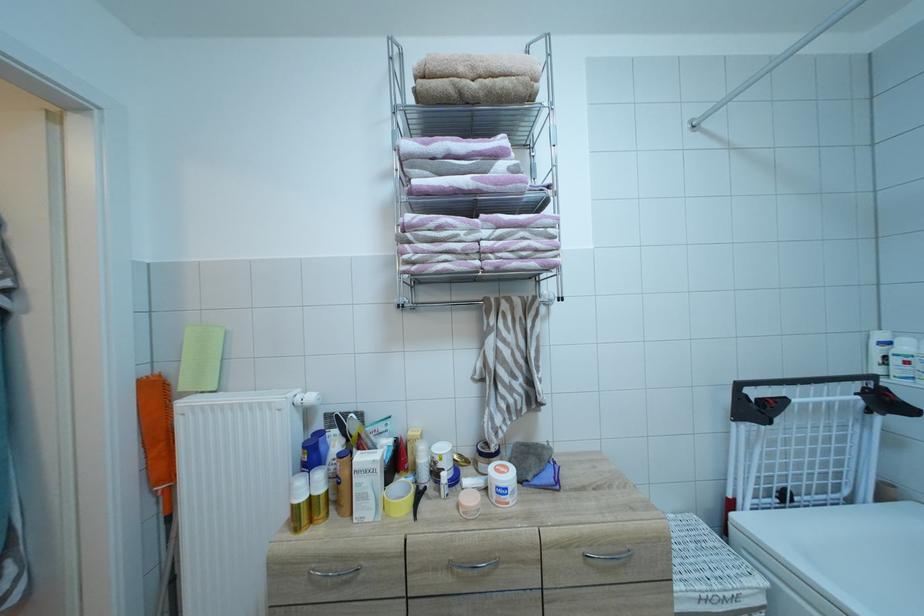
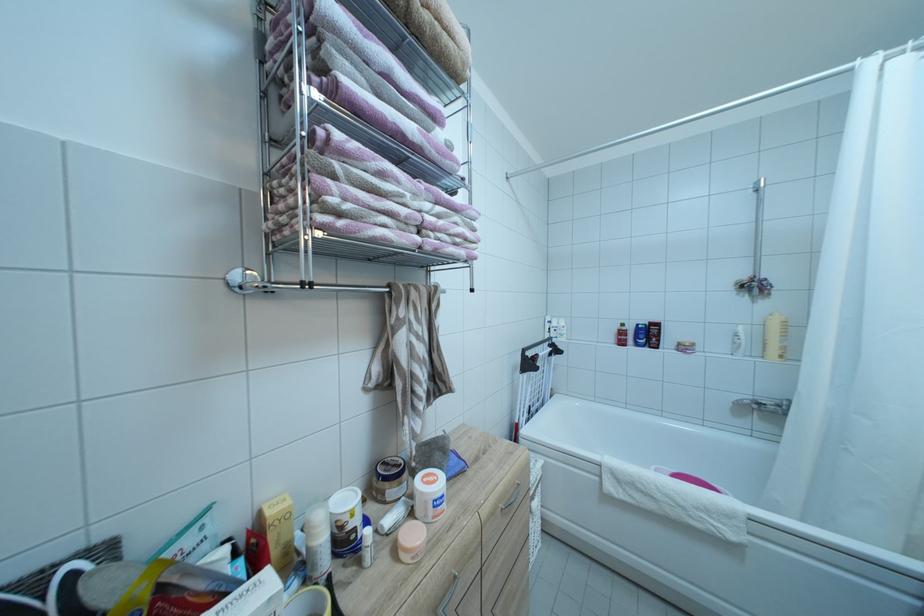
The point at (x=511, y=477) is marked in the first image. Where is the corresponding point in the second image?

(442, 487)